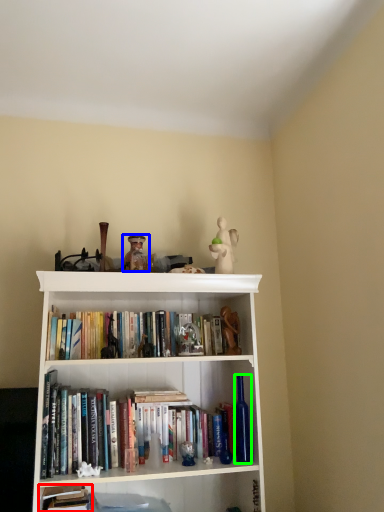
Question: Considering the real-world distances, which object is closest to book (highlighted by a red box)? toy (highlighted by a blue box) or bottle (highlighted by a green box).

Choices:
 (A) toy
 (B) bottle

Answer: (B)